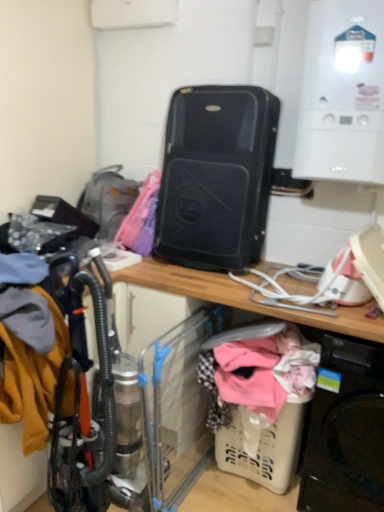
Question: From a real-world perspective, is plastic/transparent baby carriage at lower center physically below black matte suitcase at center?

Choices:
 (A) yes
 (B) no

Answer: (A)

Question: From a real-world perspective, is plastic/transparent baby carriage at lower center physically above black matte suitcase at center?

Choices:
 (A) no
 (B) yes

Answer: (A)

Question: Is plastic/transparent baby carriage at lower center further to camera compared to black matte suitcase at center?

Choices:
 (A) no
 (B) yes

Answer: (A)

Question: Can you confirm if plastic/transparent baby carriage at lower center is bigger than black matte suitcase at center?

Choices:
 (A) no
 (B) yes

Answer: (A)

Question: Can we say plastic/transparent baby carriage at lower center lies outside black matte suitcase at center?

Choices:
 (A) no
 (B) yes

Answer: (B)

Question: Is black plastic washing machine at lower right to the left or to the right of plastic/transparent baby carriage at lower center in the image?

Choices:
 (A) right
 (B) left

Answer: (A)

Question: Considering the positions of black plastic washing machine at lower right and plastic/transparent baby carriage at lower center in the image, is black plastic washing machine at lower right wider or thinner than plastic/transparent baby carriage at lower center?

Choices:
 (A) thin
 (B) wide

Answer: (B)

Question: Is point (334, 407) closer or farther from the camera than point (294, 465)?

Choices:
 (A) farther
 (B) closer

Answer: (B)

Question: From their relative heights in the image, would you say black plastic washing machine at lower right is taller or shorter than plastic/transparent baby carriage at lower center?

Choices:
 (A) short
 (B) tall

Answer: (B)

Question: From a real-world perspective, is white glossy boiler at upper right positioned above or below black plastic suitcase at center?

Choices:
 (A) above
 (B) below

Answer: (A)

Question: Considering the positions of white glossy boiler at upper right and black plastic suitcase at center in the image, is white glossy boiler at upper right bigger or smaller than black plastic suitcase at center?

Choices:
 (A) big
 (B) small

Answer: (B)

Question: Looking at their shapes, would you say white glossy boiler at upper right is wider or thinner than black plastic suitcase at center?

Choices:
 (A) thin
 (B) wide

Answer: (A)

Question: From their relative heights in the image, would you say white glossy boiler at upper right is taller or shorter than black plastic suitcase at center?

Choices:
 (A) tall
 (B) short

Answer: (B)

Question: From a real-world perspective, relative to black plastic washing machine at lower right, is black plastic suitcase at center vertically above or below?

Choices:
 (A) below
 (B) above

Answer: (B)

Question: Based on their sizes in the image, would you say black plastic suitcase at center is bigger or smaller than black plastic washing machine at lower right?

Choices:
 (A) big
 (B) small

Answer: (A)